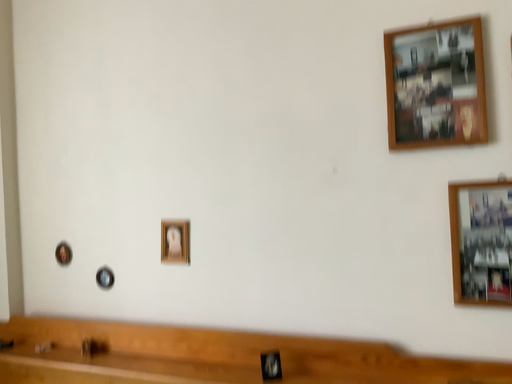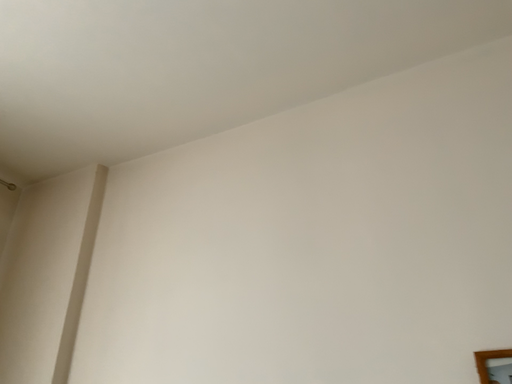
Question: How did the camera likely rotate when shooting the video?

Choices:
 (A) rotated downward
 (B) rotated upward

Answer: (B)